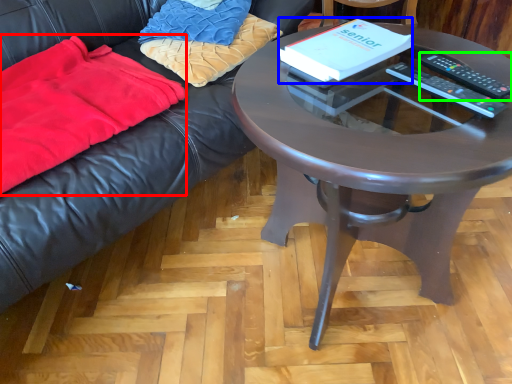
Question: Which object is positioned closest to blanket (highlighted by a red box)? Select from paperback book (highlighted by a blue box) and remote control (highlighted by a green box).

Choices:
 (A) paperback book
 (B) remote control

Answer: (A)